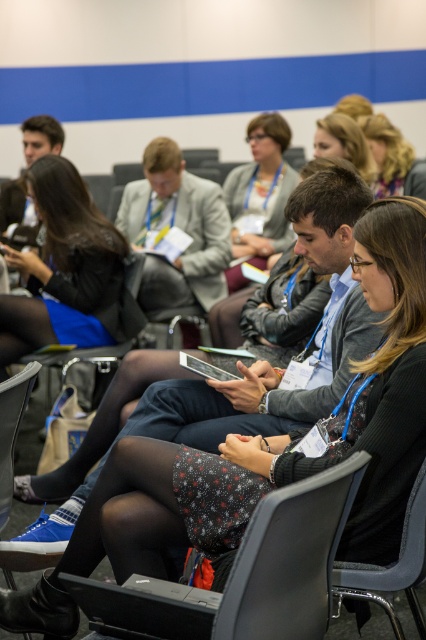
Question: Can you confirm if floral-patterned fabric skirt at center is bigger than black fabric skirt at center?

Choices:
 (A) yes
 (B) no

Answer: (A)

Question: Which object is positioned farthest from the black fabric skirt at center?

Choices:
 (A) blonde hair at upper center
 (B) matte black hair at upper center

Answer: (B)

Question: Which object is closer to the camera taking this photo?

Choices:
 (A) matte black hair at upper center
 (B) black fabric chair at lower right

Answer: (B)

Question: Does black fabric skirt at center have a lesser width compared to black plastic chair at center?

Choices:
 (A) no
 (B) yes

Answer: (A)

Question: Which of these objects is positioned closest to the black fabric skirt at center?

Choices:
 (A) matte black jacket at center
 (B) blonde hair at upper center

Answer: (A)

Question: From the image, what is the correct spatial relationship of black fabric skirt at center in relation to matte black hair at upper center?

Choices:
 (A) right
 (B) left

Answer: (B)